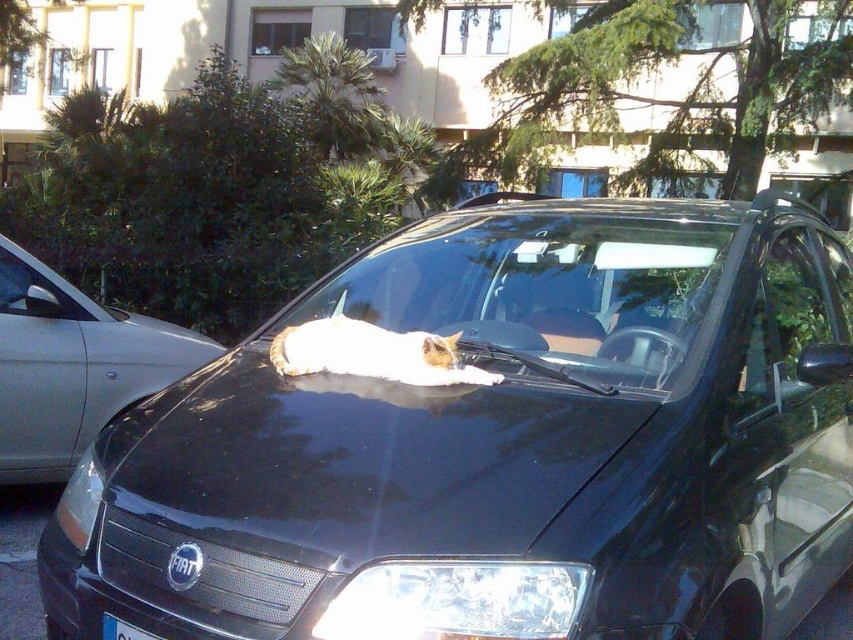
You are standing in front of a black Fiat car parked outdoors. You notice a point marked at coordinates (498, 445). What object does this point correspond to?

The point at coordinates (498, 445) corresponds to the black glossy car at center.

You are a delivery person trying to place a package on the car. The car has a clear glass windshield at center and a white plastic license plate at lower center. Where should you place the package so it doesn not block the license plate?

The clear glass windshield at center is positioned over the white plastic license plate at lower center, so placing the package on the windshield would block the license plate. Instead, place it elsewhere on the car where it won not cover the license plate.

You are a delivery person trying to place a small package on the clear glass windshield at center and the white plastic license plate at lower center. Which surface can the package fit on without overlapping the edges?

The clear glass windshield at center has a greater width than the white plastic license plate at lower center, so the package can fit on the clear glass windshield at center without overlapping the edges.